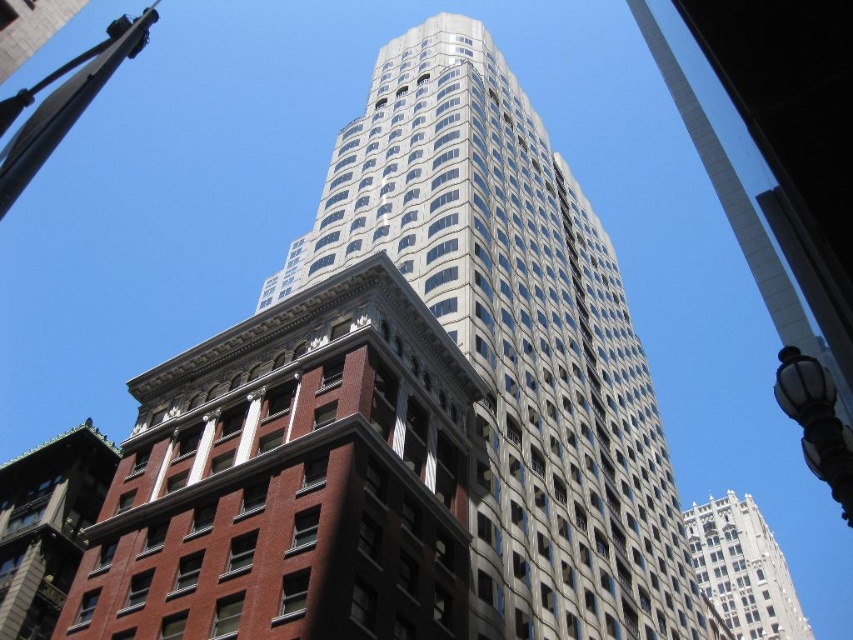
You are standing in the urban scene and want to determine the relative positions of two points marked in the image. Which point, point (514, 570) or point (770, 552), is closer to you?

Point (514, 570) is closer to the viewer than point (770, 552).

You are a city planner assessing the skyline. The white stone tower at upper center and the black glass streetlight at lower right are both visible from your vantage point. Which structure appears shorter in the image?

The white stone tower at upper center appears shorter than the black glass streetlight at lower right according to the description.

You are an architect evaluating the urban space between the glassy reflective skyscraper at center and the red brick building at lower left. Which building occupies more visual space in the image?

The glassy reflective skyscraper at center has a larger size compared to the red brick building at lower left, so it occupies more visual space in the image.